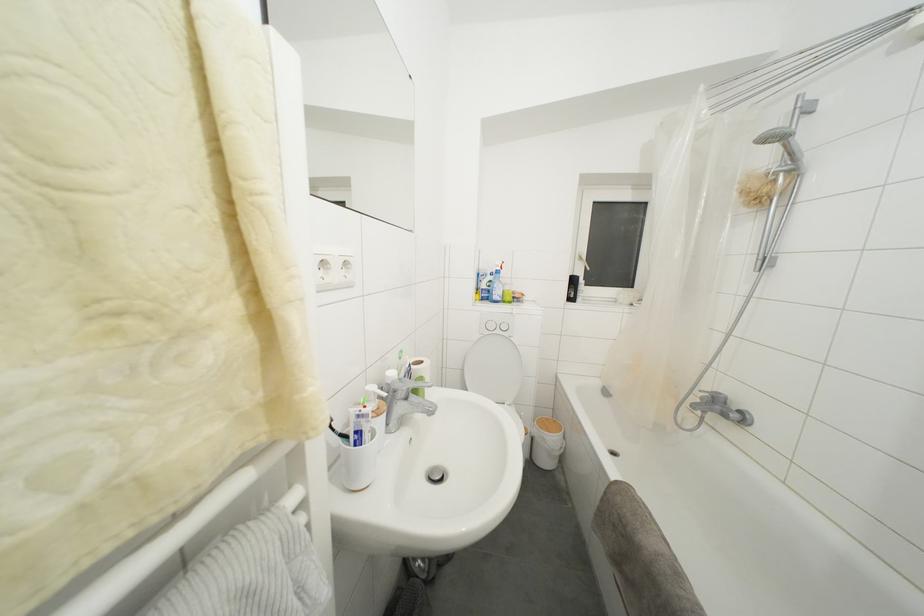
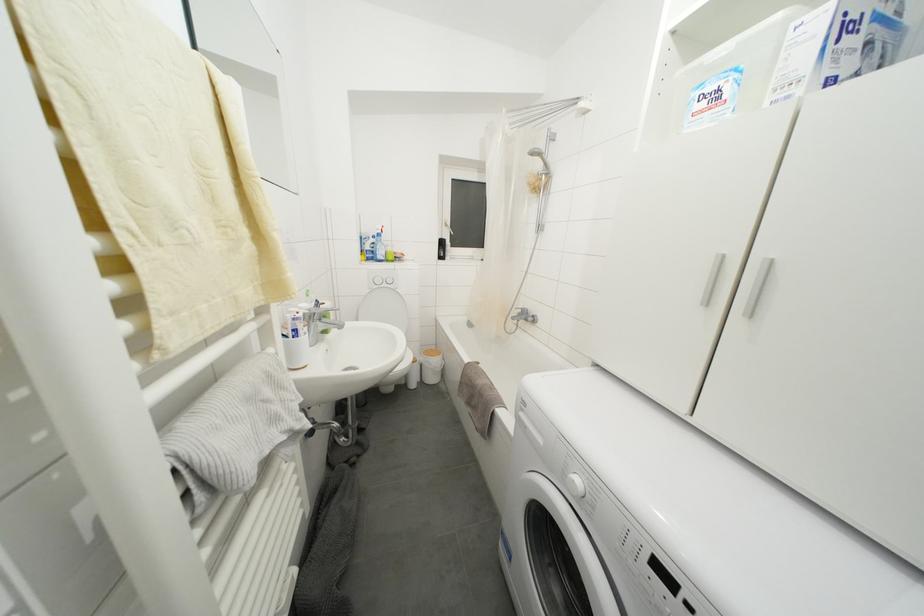
Question: The camera is either moving clockwise (left) or counter-clockwise (right) around the object. The first image is from the beginning of the video and the second image is from the end. Is the camera moving left or right when shooting the video?

Choices:
 (A) Left
 (B) Right

Answer: (A)